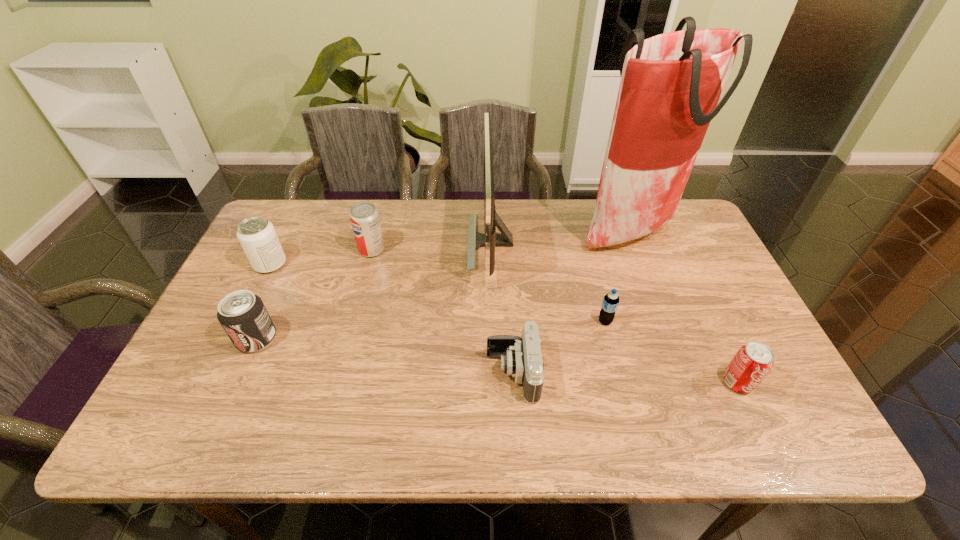
Locate an element on the screen. The image size is (960, 540). free spot located on the front of the third soda bottle from right to left is located at coordinates (342, 366).

This screenshot has height=540, width=960. Find the location of `vacant area located on the left of the nearest soda bottle`. vacant area located on the left of the nearest soda bottle is located at coordinates (645, 383).

Find the location of a particular element. The height and width of the screenshot is (540, 960). vacant point located 0.340m on the back of the second soda bottle from right to left is located at coordinates (583, 234).

Find the location of a particular element. vacant region located at the front of the camera with an open lens cover is located at coordinates (326, 373).

Find the location of a particular element. vacant space located 0.110m at the front of the camera with an open lens cover is located at coordinates (441, 373).

Identify the location of vacant space positioned at the front of the camera with an open lens cover. (444, 373).

At what (x,y) coordinates should I click in order to perform the action: click on grocery bag that is at the far edge. Please return your answer as a coordinate pair (x, y). Looking at the image, I should click on (671, 83).

The image size is (960, 540). In order to click on monitor present at the far edge in this screenshot , I will do `click(489, 240)`.

Locate an element on the screen. Image resolution: width=960 pixels, height=540 pixels. soda situated at the far edge is located at coordinates (364, 217).

Locate an element on the screen. The image size is (960, 540). grocery bag located at the right edge is located at coordinates (671, 83).